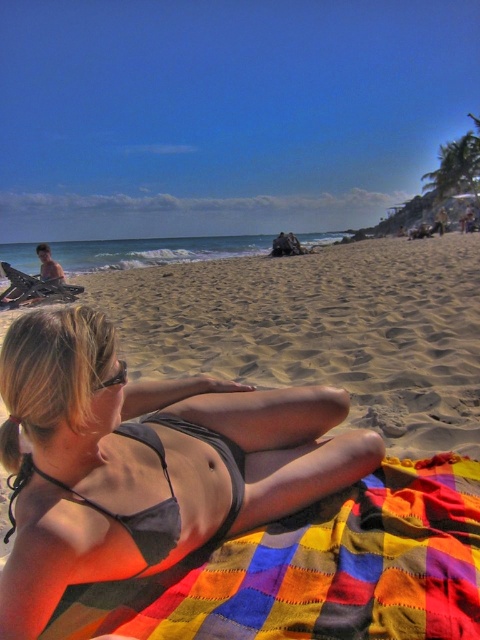
Question: Which of the following is the farthest from the observer?

Choices:
 (A) gray matte bikini at center
 (B) matte gray bikini at center

Answer: (A)

Question: Is matte gray bikini at center behind gray matte bikini at center?

Choices:
 (A) yes
 (B) no

Answer: (B)

Question: Does matte gray bikini at center appear on the right side of gray matte bikini at center?

Choices:
 (A) yes
 (B) no

Answer: (A)

Question: Which point is closer to the camera?

Choices:
 (A) gray matte bikini at center
 (B) sandy yellow at center

Answer: (A)

Question: Is sandy yellow at center further to camera compared to gray matte bikini at center?

Choices:
 (A) no
 (B) yes

Answer: (B)

Question: Which object is positioned farthest from the sandy yellow at center?

Choices:
 (A) gray matte bikini at center
 (B) multicolored patchwork blanket at lower center

Answer: (A)